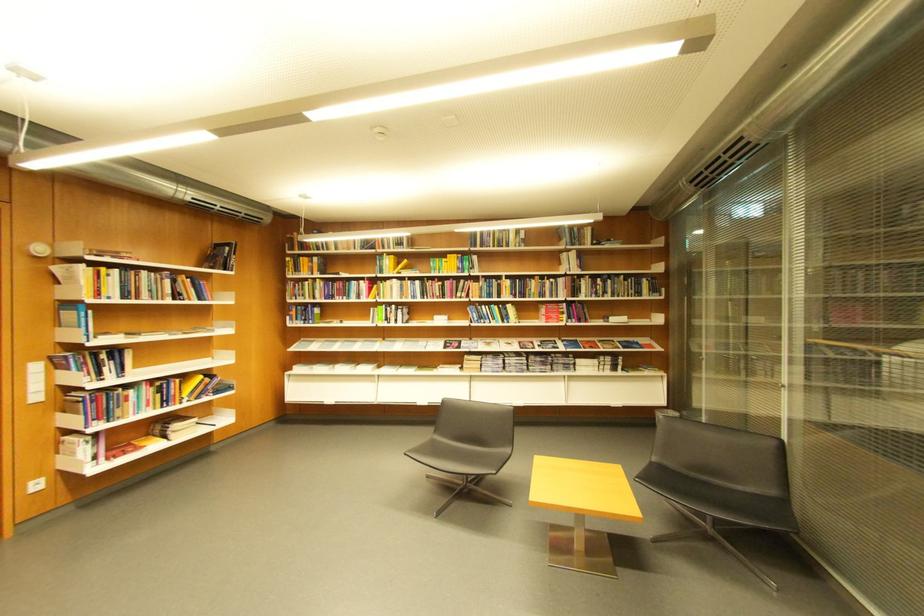
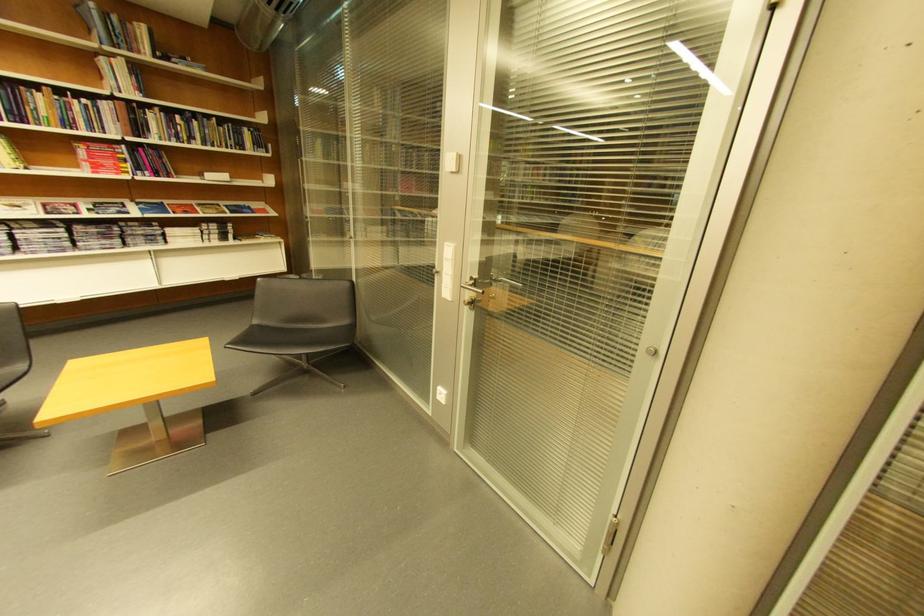
Locate, in the second image, the point that corresponds to pixel 575 256 in the first image.

(113, 62)